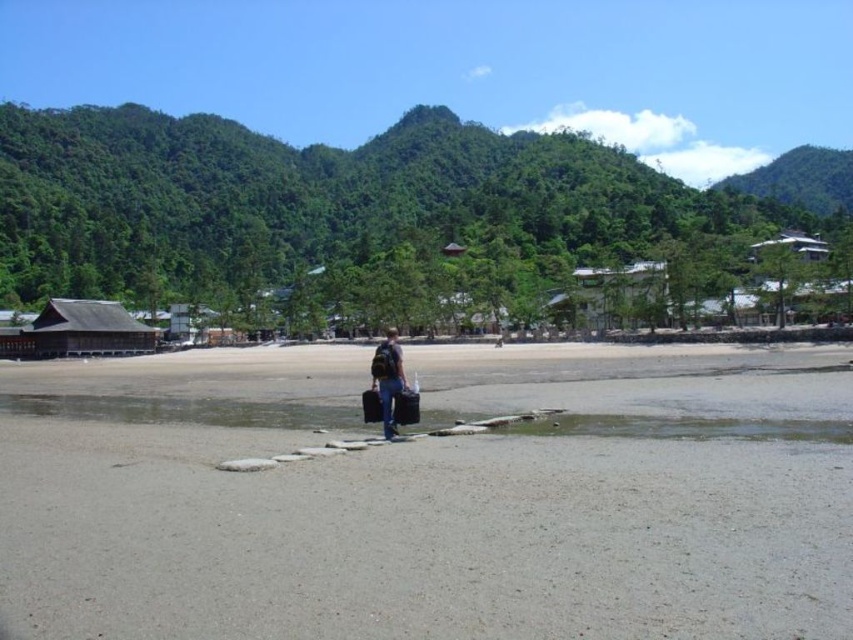
Between clear water at center and wooden hut at left, which one is positioned lower?

clear water at center

The image size is (853, 640). What do you see at coordinates (184, 410) in the screenshot?
I see `clear water at center` at bounding box center [184, 410].

Locate an element on the screen. Image resolution: width=853 pixels, height=640 pixels. clear water at center is located at coordinates (184, 410).

The height and width of the screenshot is (640, 853). Identify the location of clear water at center. (184, 410).

Locate an element on the screen. This screenshot has width=853, height=640. green leafy mountain at upper right is located at coordinates (799, 179).

Is green leafy mountain at upper right positioned behind wooden hut at left?

That is True.

The image size is (853, 640). I want to click on green leafy mountain at upper right, so (x=799, y=179).

Does green leafy forest at upper left have a lesser width compared to dark blue jeans at center?

Incorrect, green leafy forest at upper left's width is not less than dark blue jeans at center's.

In the scene shown: Which of these two, green leafy forest at upper left or dark blue jeans at center, stands taller?

green leafy forest at upper left is taller.

Is point (521, 157) less distant than point (378, 394)?

No, (521, 157) is behind (378, 394).

Where is `green leafy forest at upper left`? The height and width of the screenshot is (640, 853). green leafy forest at upper left is located at coordinates (386, 218).